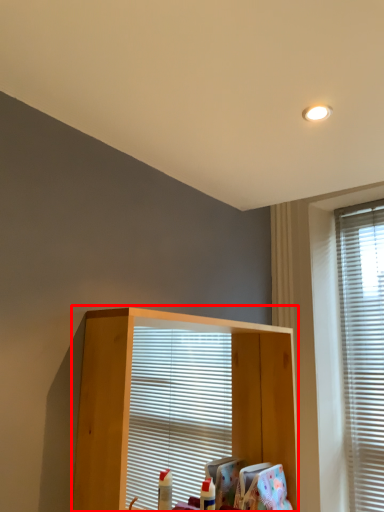
Question: From the image's perspective, where is shelf (annotated by the red box) located in relation to window in the image?

Choices:
 (A) below
 (B) above

Answer: (A)